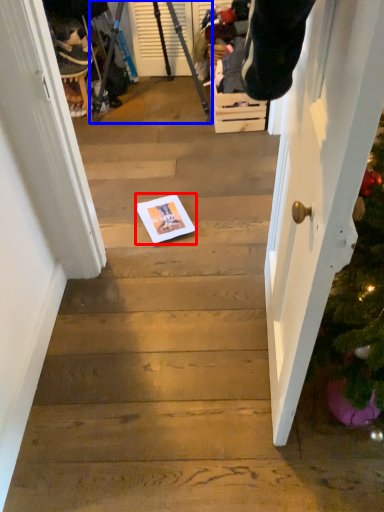
Question: Which of the following is the closest to the observer, copy (highlighted by a red box) or tripod (highlighted by a blue box)?

Choices:
 (A) copy
 (B) tripod

Answer: (A)